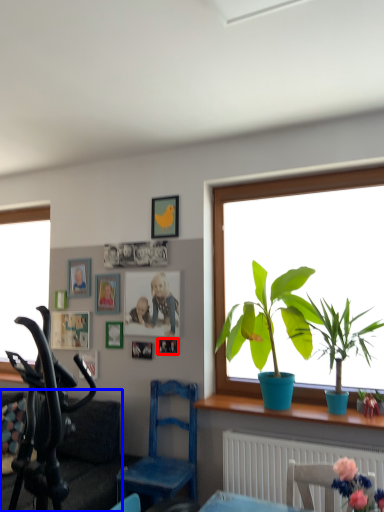
Question: Among these objects, which one is farthest to the camera, picture frame (highlighted by a red box) or couch (highlighted by a blue box)?

Choices:
 (A) picture frame
 (B) couch

Answer: (A)